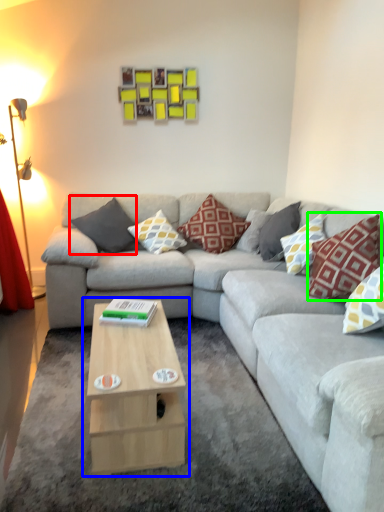
Question: Considering the real-world distances, which object is farthest from pillow (highlighted by a red box)? coffee table (highlighted by a blue box) or pillow (highlighted by a green box)?

Choices:
 (A) coffee table
 (B) pillow

Answer: (B)